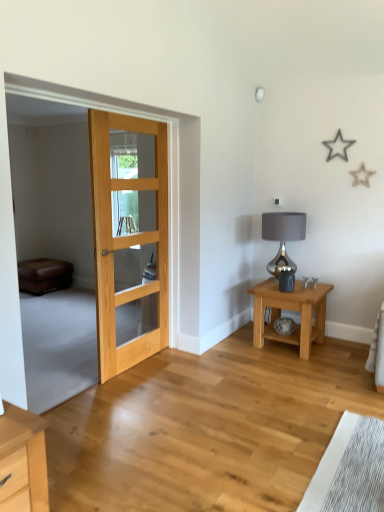
Find the location of `free point in front of light brown wood nightstand at lower right`. free point in front of light brown wood nightstand at lower right is located at coordinates (301, 369).